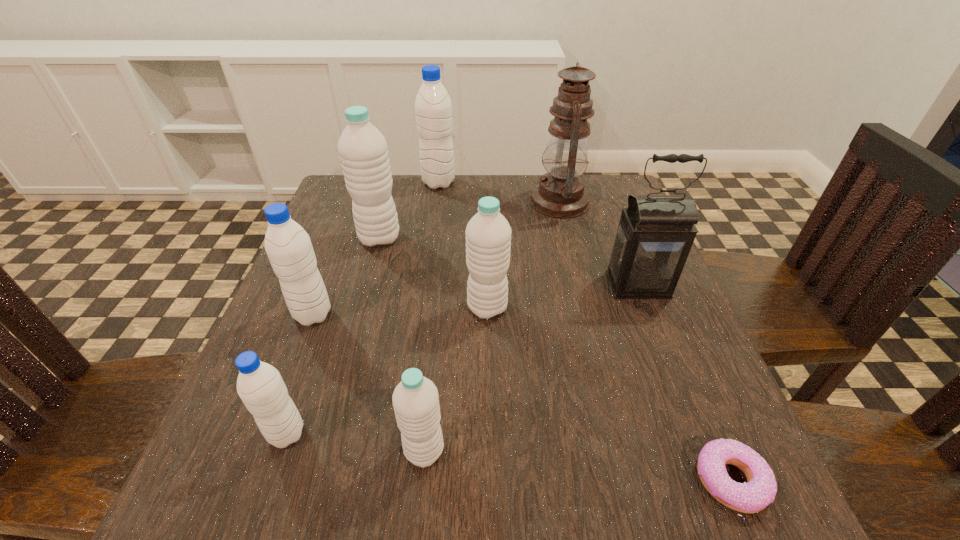
Locate an element on the screen. Image resolution: width=960 pixels, height=540 pixels. the nearest white water bottle is located at coordinates (415, 399).

Locate an element on the screen. This screenshot has height=540, width=960. the second white water bottle from left to right is located at coordinates (415, 399).

In order to click on the shortest object in this screenshot , I will do `click(760, 490)`.

Locate an element on the screen. This screenshot has height=540, width=960. doughnut is located at coordinates (760, 490).

Locate an element on the screen. vacant space located 0.400m on the front of the oil lamp is located at coordinates (597, 355).

Image resolution: width=960 pixels, height=540 pixels. I want to click on free location located on the right of the farthest gray water bottle, so click(x=477, y=183).

Image resolution: width=960 pixels, height=540 pixels. Identify the location of vacant area situated 0.220m on the right of the leftmost white water bottle. (495, 238).

Where is `free location located 0.130m on the front-facing side of the gray lantern`? free location located 0.130m on the front-facing side of the gray lantern is located at coordinates (665, 355).

Locate an element on the screen. The image size is (960, 540). vacant space located on the back of the sixth object from left to right is located at coordinates (487, 271).

Image resolution: width=960 pixels, height=540 pixels. What are the coordinates of `free space located 0.230m on the right of the second smallest gray water bottle` in the screenshot? It's located at (453, 315).